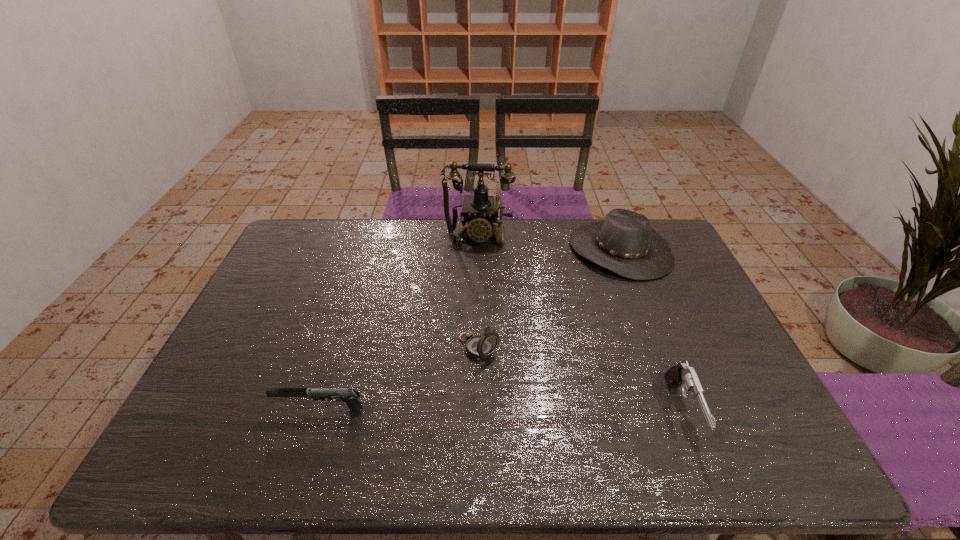
Locate an element on the screen. This screenshot has height=540, width=960. vacant space located 0.320m on the rotary dial of the tallest object is located at coordinates pos(468,318).

This screenshot has width=960, height=540. I want to click on free space located 0.240m on the face of the compass, so click(562, 422).

Find the location of a particular element. This screenshot has width=960, height=540. blank space located on the face of the compass is located at coordinates (514, 380).

Identify the location of vacant space located 0.250m on the face of the compass. (564, 426).

Find the location of a particular element. This screenshot has width=960, height=540. vacant region located 0.400m on the front-facing side of the hat is located at coordinates (530, 350).

Locate an element on the screen. The width and height of the screenshot is (960, 540). free point located 0.260m on the front-facing side of the hat is located at coordinates (557, 321).

Where is `vacant area situated 0.310m on the front-facing side of the hat`? The image size is (960, 540). vacant area situated 0.310m on the front-facing side of the hat is located at coordinates (547, 331).

This screenshot has height=540, width=960. Find the location of `telephone that is positioned at the far edge`. telephone that is positioned at the far edge is located at coordinates (x=480, y=211).

At what (x,y) coordinates should I click in order to perform the action: click on hat present at the far edge. Please return your answer as a coordinate pair (x, y). Looking at the image, I should click on (624, 243).

This screenshot has height=540, width=960. I want to click on object that is at the right edge, so click(x=624, y=243).